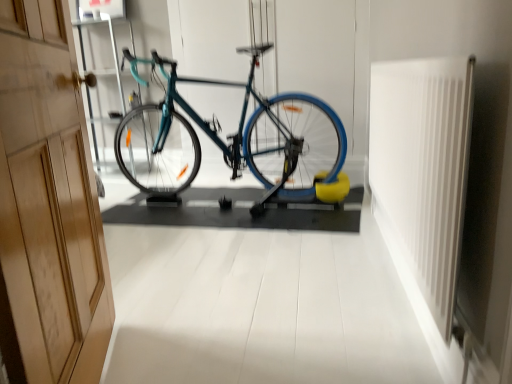
Question: In terms of size, does teal glossy bicycle at center appear bigger or smaller than white plastic radiator at right?

Choices:
 (A) big
 (B) small

Answer: (A)

Question: In terms of height, does teal glossy bicycle at center look taller or shorter compared to white plastic radiator at right?

Choices:
 (A) tall
 (B) short

Answer: (A)

Question: Which of these objects is positioned closest to the wooden at left?

Choices:
 (A) white plastic radiator at right
 (B) teal glossy bicycle at center

Answer: (A)

Question: Which is farther from the white plastic radiator at right?

Choices:
 (A) teal glossy bicycle at center
 (B) wooden at left

Answer: (A)